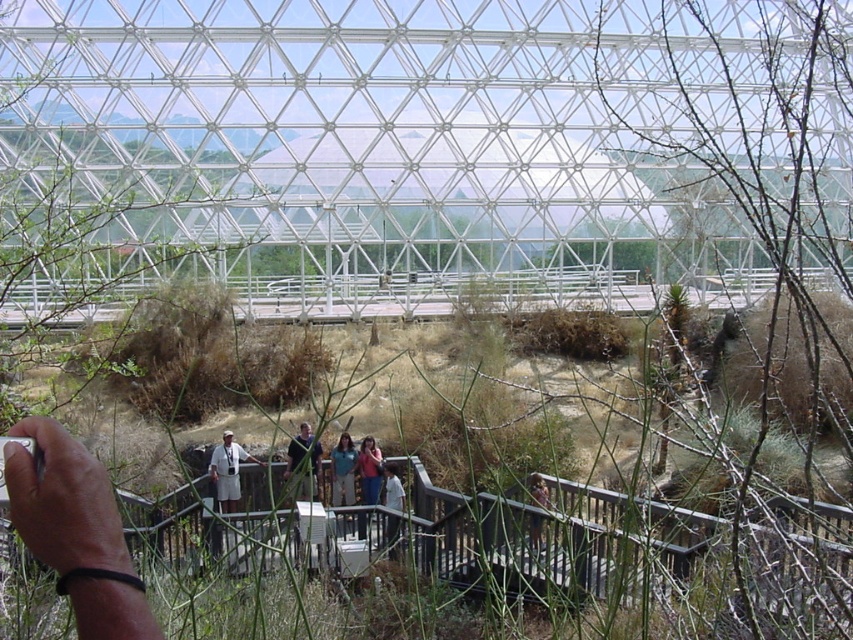
Question: Can you confirm if white cotton shirt at center is smaller than light blue shirt at center?

Choices:
 (A) yes
 (B) no

Answer: (B)

Question: Which point is closer to the camera?

Choices:
 (A) light blue shirt at center
 (B) light brown wooden post at center
 (C) dark blue shirt at center

Answer: (C)

Question: Which point is closer to the camera?

Choices:
 (A) (234, 465)
 (B) (395, 493)

Answer: (A)

Question: Is black rubber wristband at lower left smaller than white cotton shirt at center?

Choices:
 (A) yes
 (B) no

Answer: (B)

Question: Does light blue shirt at center have a larger size compared to light brown wooden post at center?

Choices:
 (A) no
 (B) yes

Answer: (A)

Question: Which object appears farthest from the camera in this image?

Choices:
 (A) light blue shirt at center
 (B) light brown wooden post at center
 (C) dark blue shirt at center
 (D) white cotton shirt at center

Answer: (A)